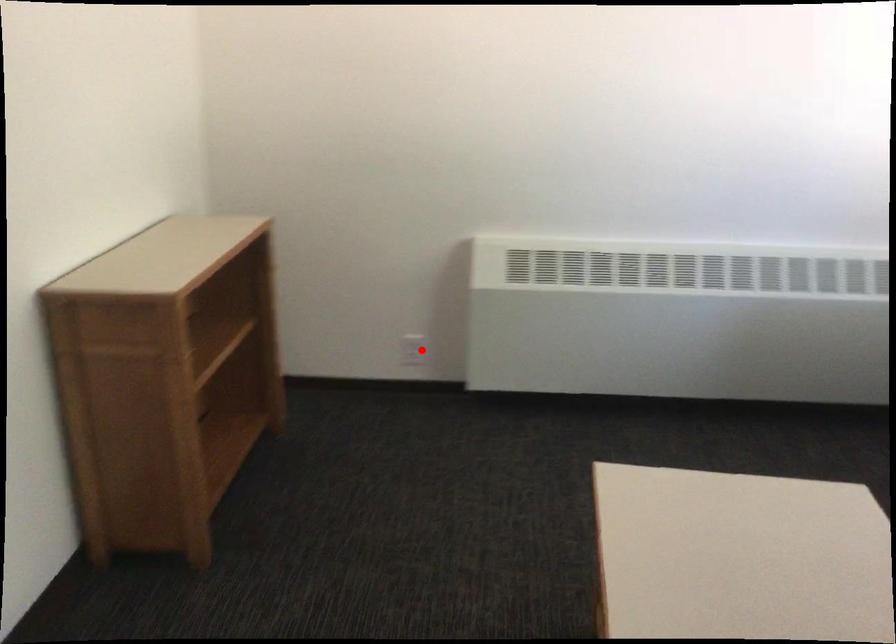
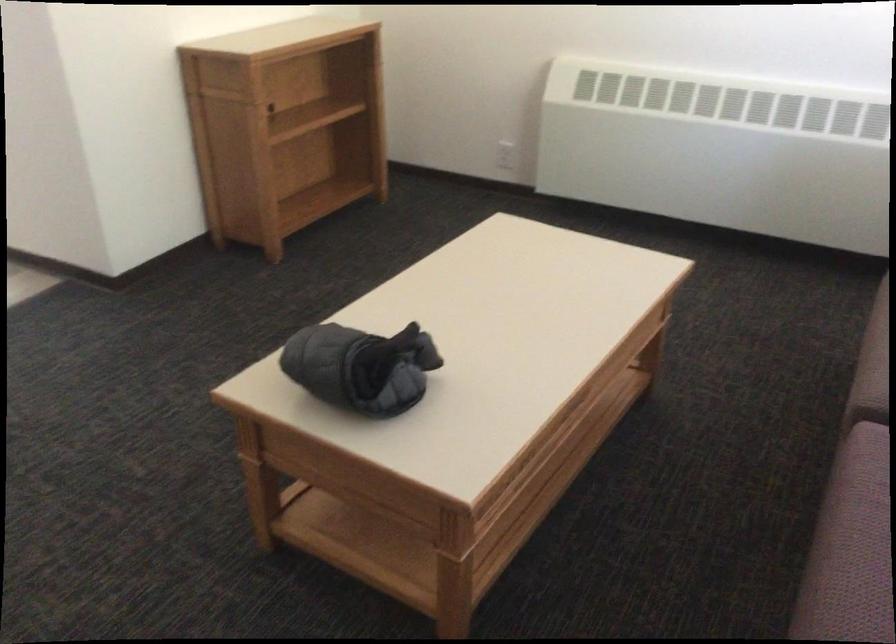
Question: I am providing you with two images of the same scene from different viewpoints. Image1 has a red point marked. In image2, the corresponding 3D location appears at what relative position? Reply with the corresponding letter.

Choices:
 (A) Closer
 (B) Farther

Answer: (B)